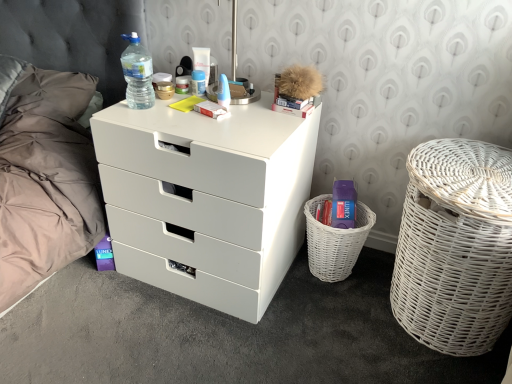
Where is `vacant area in front of blue plastic container at center, which appears as the 3th toiletry when viewed from the right`? vacant area in front of blue plastic container at center, which appears as the 3th toiletry when viewed from the right is located at coordinates (186, 100).